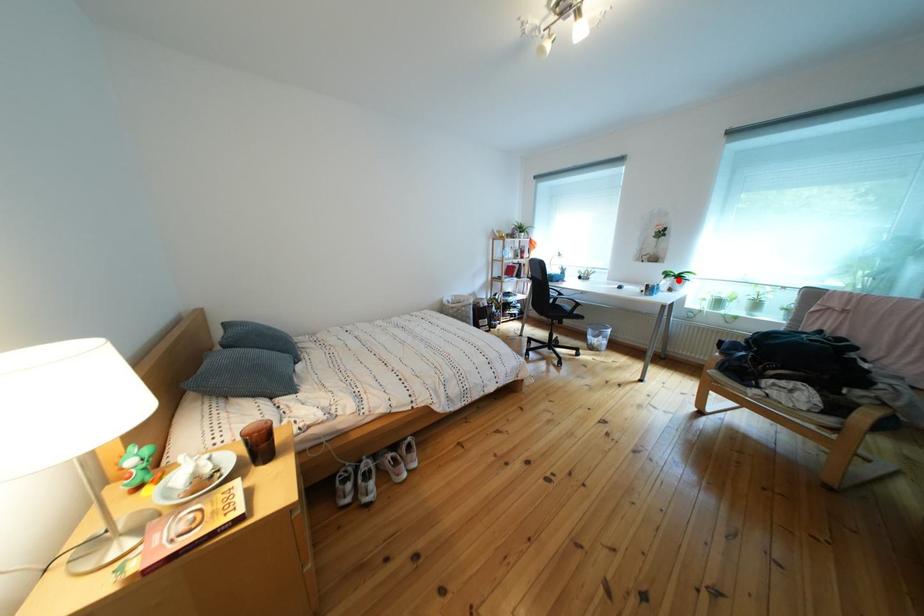
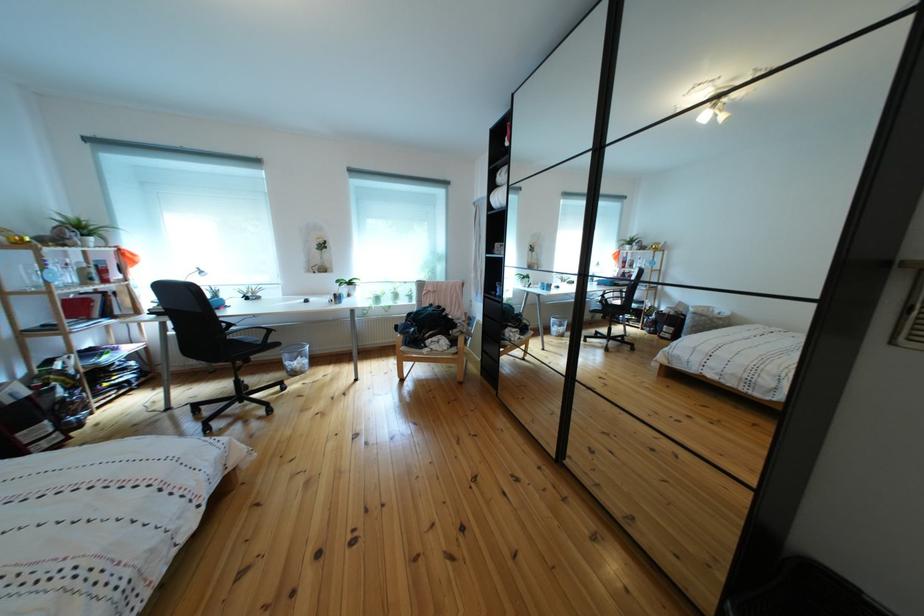
Where in the second image is the point corresponding to the highlighted location from the first image?

(351, 288)